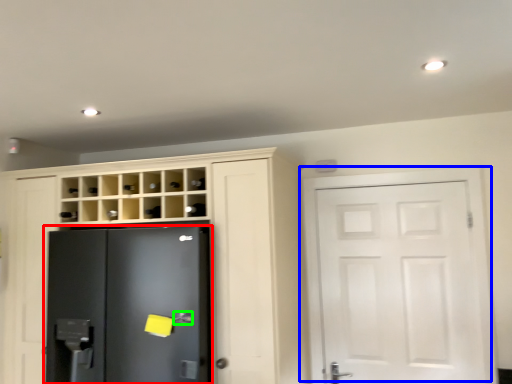
Question: Considering the real-world distances, which object is farthest from refrigerator (highlighted by a red box)? door (highlighted by a blue box) or door handle (highlighted by a green box)?

Choices:
 (A) door
 (B) door handle

Answer: (A)